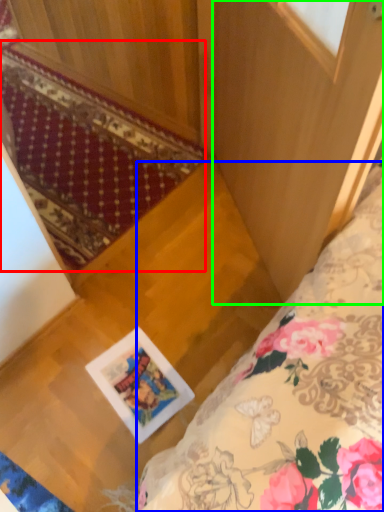
Question: Which object is the closest to the mat (highlighted by a red box)? Choose among these: bed (highlighted by a blue box) or screen door (highlighted by a green box).

Choices:
 (A) bed
 (B) screen door

Answer: (B)